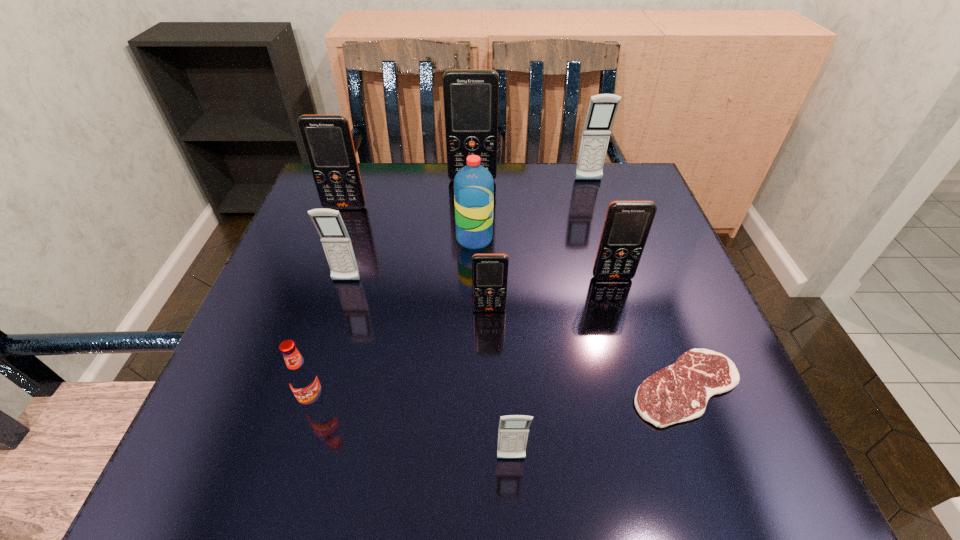
Find the location of a particular element. vacant region that satisfies the following two spatial constraints: 1. on the screen of the second biggest orange cellular telephone; 2. on the right side of the red root beer is located at coordinates pos(275,402).

Image resolution: width=960 pixels, height=540 pixels. In order to click on vacant space that satisfies the following two spatial constraints: 1. on the front-facing side of the leftmost gray cellular telephone; 2. on the right side of the red root beer in this screenshot , I will do `click(309, 402)`.

The height and width of the screenshot is (540, 960). I want to click on blank area in the image that satisfies the following two spatial constraints: 1. on the front-facing side of the farthest gray cellular telephone; 2. on the front label of the water bottle, so 607,239.